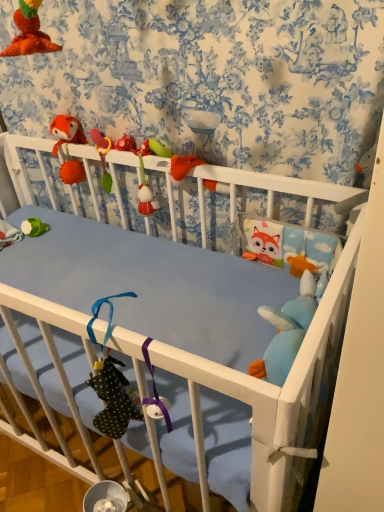
Question: From a real-world perspective, is soft plush toy at right, which ranks as the 2th toy in top-to-bottom order, physically located above or below fluffy orange fox at upper left, the first toy positioned from the back?

Choices:
 (A) above
 (B) below

Answer: (B)

Question: Looking at the image, does soft plush toy at right, the 1th toy in the right-to-left sequence, seem bigger or smaller compared to fluffy orange fox at upper left, positioned as the 1th toy in left-to-right order?

Choices:
 (A) small
 (B) big

Answer: (A)

Question: Relative to fluffy orange fox at upper left, which is counted as the second toy, starting from the right, is soft plush toy at right, which ranks as the 2th toy in top-to-bottom order, in front or behind?

Choices:
 (A) front
 (B) behind

Answer: (A)

Question: Relative to soft plush toy at right, the 1th toy in the right-to-left sequence, is fluffy orange fox at upper left, positioned as the second toy in bottom-to-top order, in front or behind?

Choices:
 (A) behind
 (B) front

Answer: (A)

Question: In the image, is fluffy orange fox at upper left, positioned as the second toy in bottom-to-top order, on the left side or the right side of soft plush toy at right, which ranks as the 2th toy in top-to-bottom order?

Choices:
 (A) left
 (B) right

Answer: (A)

Question: Considering the positions of fluffy orange fox at upper left, positioned as the second toy in bottom-to-top order, and soft plush toy at right, placed as the second toy when sorted from back to front, in the image, is fluffy orange fox at upper left, positioned as the second toy in bottom-to-top order, bigger or smaller than soft plush toy at right, placed as the second toy when sorted from back to front,?

Choices:
 (A) big
 (B) small

Answer: (A)

Question: Which is correct: fluffy orange fox at upper left, the 1th toy when ordered from top to bottom, is inside soft plush toy at right, the 1th toy in the right-to-left sequence, or outside of it?

Choices:
 (A) inside
 (B) outside

Answer: (B)